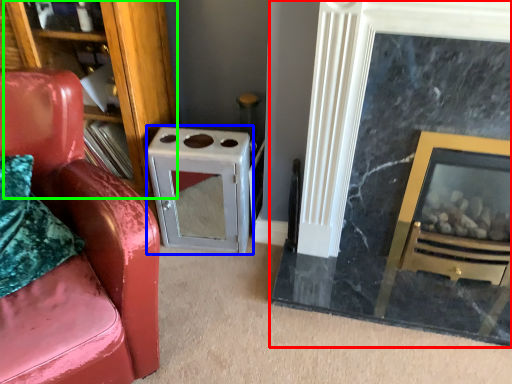
Question: Estimate the real-world distances between objects in this image. Which object is farther from fireplace (highlighted by a red box), appliance (highlighted by a blue box) or bookshelf (highlighted by a green box)?

Choices:
 (A) appliance
 (B) bookshelf

Answer: (B)